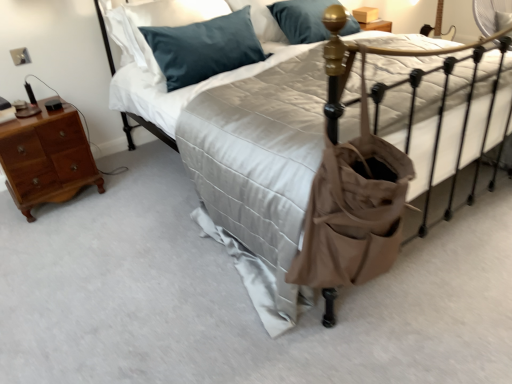
Question: Is satin blue pillow at upper center, arranged as the first pillow when viewed from the front, turned away from matte beige bed at center?

Choices:
 (A) no
 (B) yes

Answer: (A)

Question: From a real-world perspective, is satin blue pillow at upper center, arranged as the first pillow when viewed from the front, physically above matte beige bed at center?

Choices:
 (A) no
 (B) yes

Answer: (B)

Question: Is matte beige bed at center a part of satin blue pillow at upper center, placed as the second pillow when sorted from back to front?

Choices:
 (A) yes
 (B) no

Answer: (B)

Question: Is satin blue pillow at upper center, placed as the second pillow when sorted from back to front, outside of matte beige bed at center?

Choices:
 (A) yes
 (B) no

Answer: (A)

Question: Could you tell me if satin blue pillow at upper center, arranged as the first pillow when viewed from the front, is facing matte beige bed at center?

Choices:
 (A) no
 (B) yes

Answer: (B)

Question: Can you confirm if satin blue pillow at upper center, placed as the second pillow when sorted from back to front, is wider than matte beige bed at center?

Choices:
 (A) yes
 (B) no

Answer: (B)

Question: Considering the relative sizes of matte brown tote at center and light brown wood nightstand at left in the image provided, is matte brown tote at center thinner than light brown wood nightstand at left?

Choices:
 (A) yes
 (B) no

Answer: (A)

Question: Does matte brown tote at center have a larger size compared to light brown wood nightstand at left?

Choices:
 (A) no
 (B) yes

Answer: (A)

Question: From the image's perspective, would you say matte brown tote at center is shown under light brown wood nightstand at left?

Choices:
 (A) no
 (B) yes

Answer: (B)

Question: From a real-world perspective, is matte brown tote at center physically above light brown wood nightstand at left?

Choices:
 (A) no
 (B) yes

Answer: (B)

Question: Is the depth of matte brown tote at center less than that of light brown wood nightstand at left?

Choices:
 (A) yes
 (B) no

Answer: (A)

Question: Is matte brown tote at center facing away from light brown wood nightstand at left?

Choices:
 (A) no
 (B) yes

Answer: (A)

Question: Is teal fabric pillow at upper left, the second pillow viewed from the front, facing towards matte brown tote at center?

Choices:
 (A) no
 (B) yes

Answer: (B)